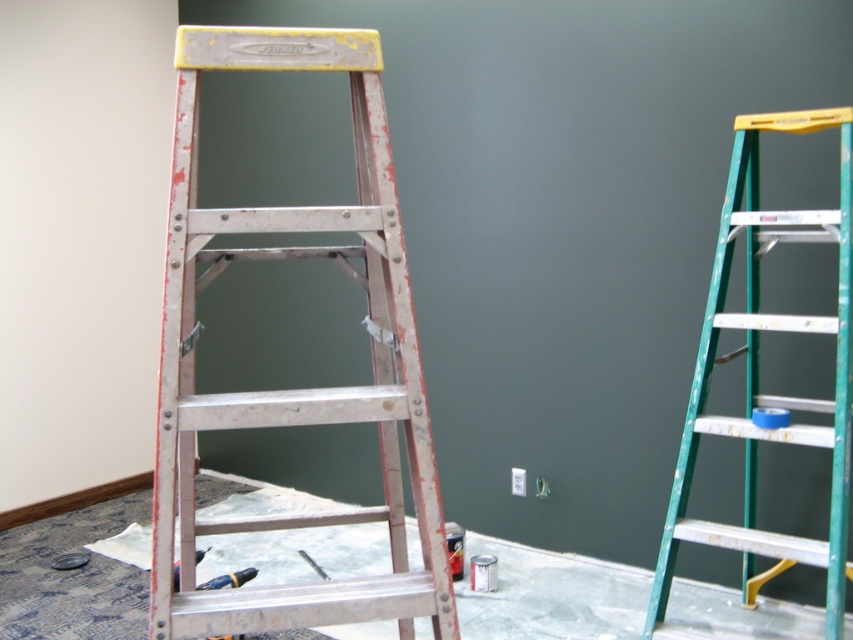
You are a painter who needs to place a 15 cm tall paint can between the yellow plastic drill at lower left and the metallic silver screwdriver at lower center. Can you fit it there based on their height difference?

The yellow plastic drill at lower left is taller than the metallic silver screwdriver at lower center. Since the paint can is 15 cm tall, it can be placed between them as the height difference allows enough space.

You are a painter working in the room and need to move the yellow plastic drill at lower left closer to the wall. Which direction should you move it to avoid the green metallic ladder at right?

Move the yellow plastic drill at lower left to the left to avoid the green metallic ladder at right, which is positioned to its right side.

You are a painter standing at the center of the room. You notice two points marked on the wall where you need to place hooks for hanging tools. The first point is at coordinates point (793, 132) and the second is at point (311, 560). Which point should you reach first if you want to start from the closest one?

You should reach point (793, 132) first because it is closer to you than point (311, 560).